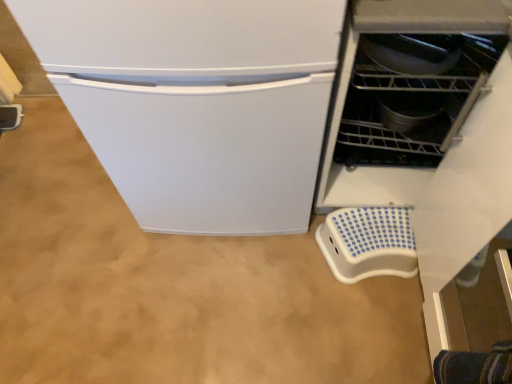
Question: Considering their positions, is blue dotted plastic step stool at lower right located in front of or behind metallic gray dishwasher at right?

Choices:
 (A) behind
 (B) front

Answer: (A)

Question: Is blue dotted plastic step stool at lower right inside the boundaries of metallic gray dishwasher at right, or outside?

Choices:
 (A) outside
 (B) inside

Answer: (A)

Question: From a real-world perspective, is blue dotted plastic step stool at lower right physically located above or below metallic gray dishwasher at right?

Choices:
 (A) below
 (B) above

Answer: (A)

Question: Is metallic gray dishwasher at right in front of or behind blue dotted plastic step stool at lower right in the image?

Choices:
 (A) behind
 (B) front

Answer: (B)

Question: Would you say metallic gray dishwasher at right is inside or outside blue dotted plastic step stool at lower right?

Choices:
 (A) inside
 (B) outside

Answer: (B)

Question: From their relative heights in the image, would you say metallic gray dishwasher at right is taller or shorter than blue dotted plastic step stool at lower right?

Choices:
 (A) short
 (B) tall

Answer: (B)

Question: Considering the relative positions of metallic gray dishwasher at right and blue dotted plastic step stool at lower right in the image provided, is metallic gray dishwasher at right to the left or to the right of blue dotted plastic step stool at lower right?

Choices:
 (A) right
 (B) left

Answer: (B)